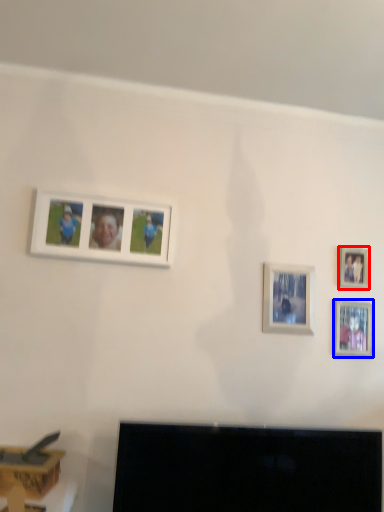
Question: Which object is further to the camera taking this photo, picture frame (highlighted by a red box) or picture frame (highlighted by a blue box)?

Choices:
 (A) picture frame
 (B) picture frame

Answer: (A)